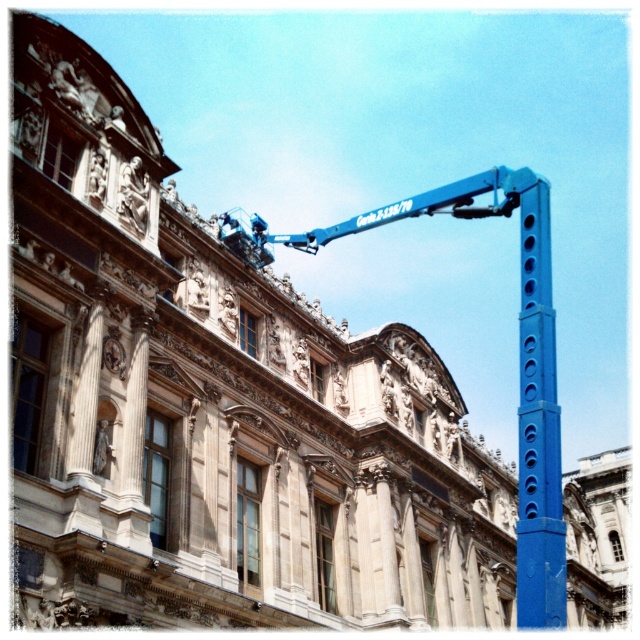
Which is more to the left, blue metallic crane at upper center or blue metallic pole at right?

Positioned to the left is blue metallic pole at right.

Is point (536, 557) farther from camera compared to point (541, 364)?

No.

Identify the location of blue metallic crane at upper center. The width and height of the screenshot is (640, 640). (518, 355).